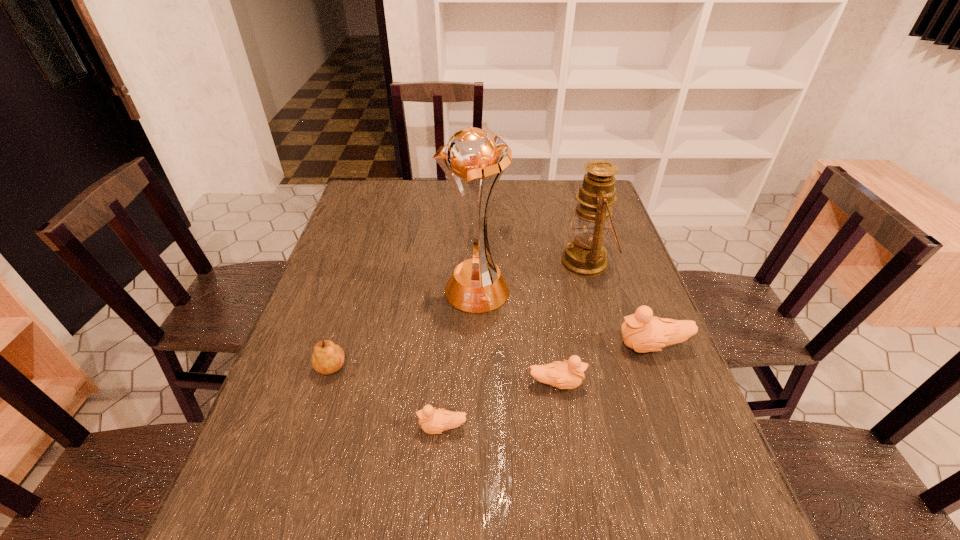
Locate an element on the screen. This screenshot has height=540, width=960. the closest duckling relative to the trophy is located at coordinates (564, 375).

In order to click on free location that satisfies the following two spatial constraints: 1. on the back side of the second tallest object; 2. on the right side of the pear in this screenshot , I will do `click(370, 262)`.